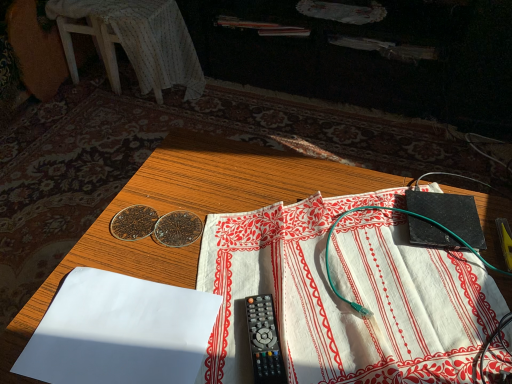
Where is `free space above white paper at lower left, which appears as the 1th sheet when viewed from the left (from a real-world perspective)`? This screenshot has width=512, height=384. free space above white paper at lower left, which appears as the 1th sheet when viewed from the left (from a real-world perspective) is located at coordinates (119, 332).